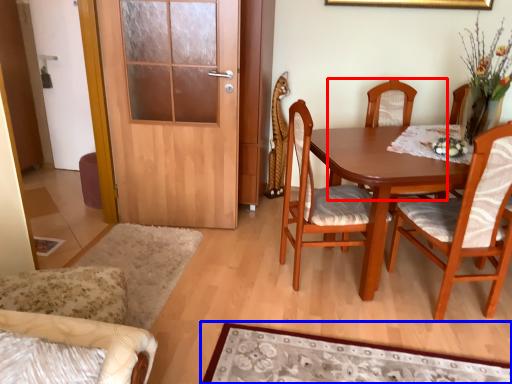
Question: Which object appears closest to the camera in this image, chair (highlighted by a red box) or mat (highlighted by a blue box)?

Choices:
 (A) chair
 (B) mat

Answer: (B)